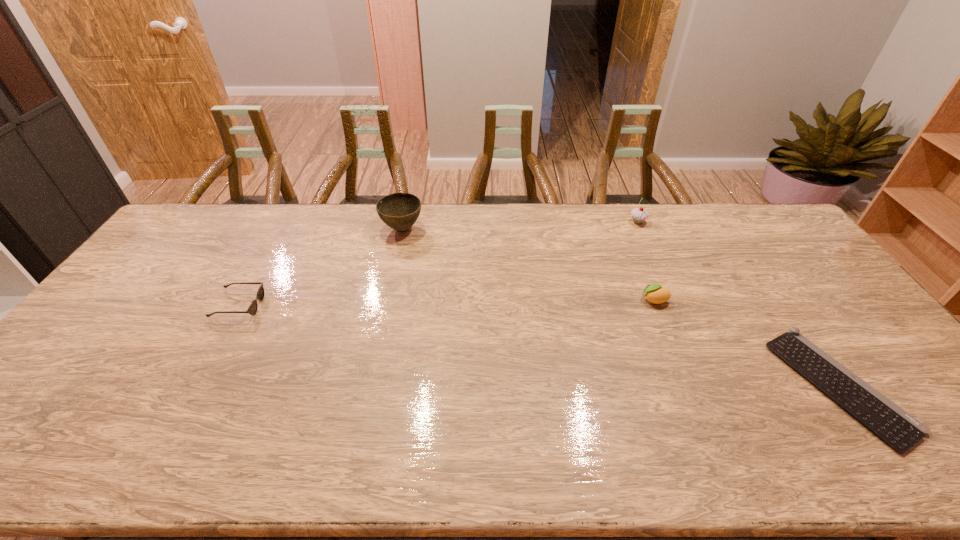
Identify the location of vacant space at the near edge. pos(414,449).

Identify the location of vacant space at the left edge. Image resolution: width=960 pixels, height=540 pixels. (63, 417).

At what (x,y) coordinates should I click in order to perform the action: click on free spot between the lemon and the leftmost object. Please return your answer as a coordinate pair (x, y). Looking at the image, I should click on coord(446,303).

The image size is (960, 540). Find the location of `vacant space that's between the second shortest object and the lemon`. vacant space that's between the second shortest object and the lemon is located at coordinates (446, 303).

You are a GUI agent. You are given a task and a screenshot of the screen. Output one action in this format:
    pyautogui.click(x=<x>, y=<y>)
    Task: Click on the free space between the rightmost object and the leftmost object
    
    Given the screenshot: What is the action you would take?
    pyautogui.click(x=539, y=346)

Where is `empty space between the leftmost object and the cupcake`? empty space between the leftmost object and the cupcake is located at coordinates (439, 264).

Where is `empty space between the leftmost object and the third tallest object`? empty space between the leftmost object and the third tallest object is located at coordinates (446, 303).

Identify the location of vacant space that's between the second object from left to right and the lemon. (528, 265).

Where is `unoccupied position between the sunglasses and the cupcake`? unoccupied position between the sunglasses and the cupcake is located at coordinates (439, 264).

At what (x,y) coordinates should I click in order to perform the action: click on free point between the third tallest object and the cupcake. Please return your answer as a coordinate pair (x, y). Image resolution: width=960 pixels, height=540 pixels. Looking at the image, I should click on (646, 261).